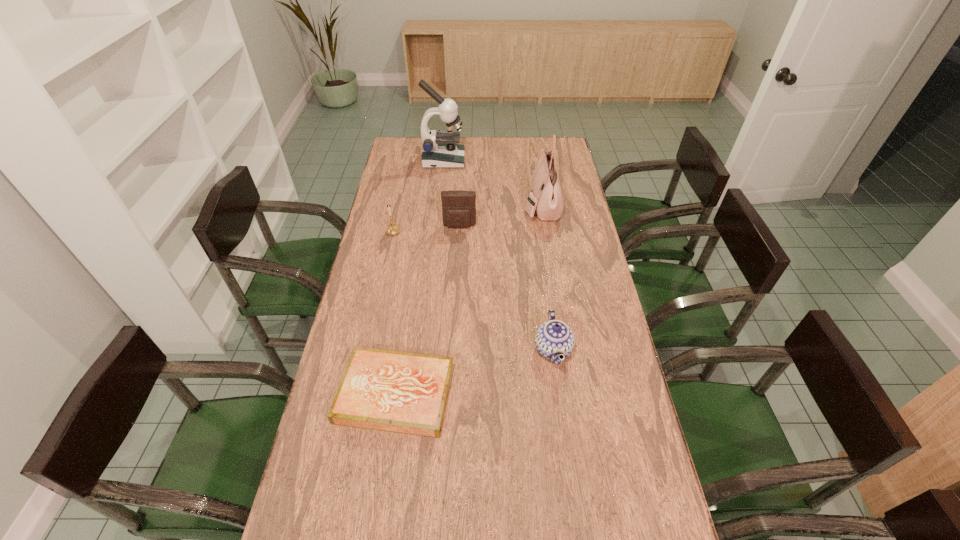
Find the location of `microscope that is at the left edge`. microscope that is at the left edge is located at coordinates (440, 150).

Where is `candle holder present at the left edge`? candle holder present at the left edge is located at coordinates (393, 229).

Find the location of a particular element. hardback book that is at the left edge is located at coordinates (401, 392).

This screenshot has width=960, height=540. In order to click on handbag that is at the right edge in this screenshot , I will do `click(547, 199)`.

This screenshot has width=960, height=540. Identify the location of chinaware at the right edge. coord(553,338).

Where is `object that is at the far left corner`? object that is at the far left corner is located at coordinates click(x=440, y=150).

Find the location of `free space at the far edge of the desktop`. free space at the far edge of the desktop is located at coordinates (517, 147).

In the image, there is a desktop. In order to click on free space at the left edge in this screenshot , I will do coord(392,200).

In the image, there is a desktop. Where is `free space at the right edge`? free space at the right edge is located at coordinates (640, 477).

This screenshot has width=960, height=540. What are the coordinates of `vacant space at the far left corner of the desktop` in the screenshot? It's located at (416, 138).